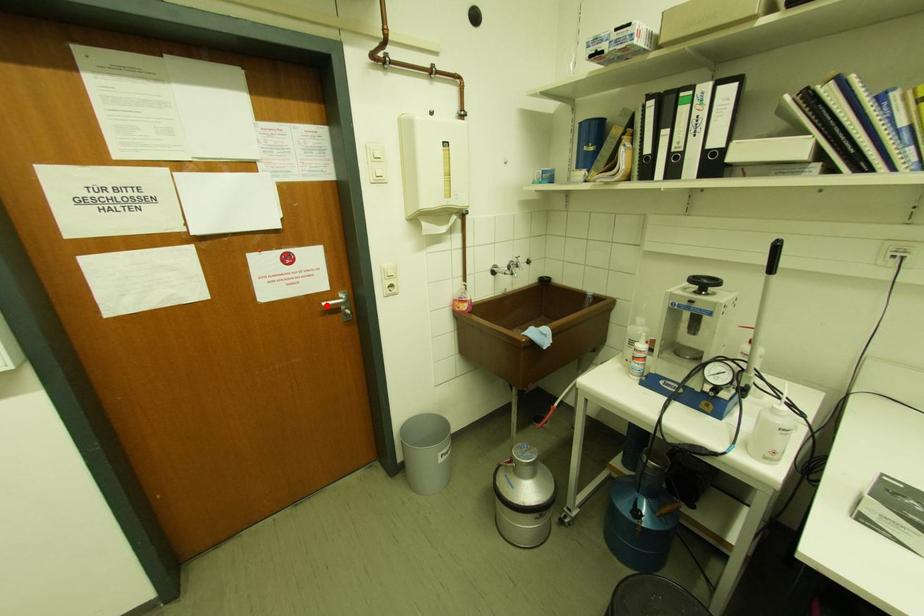
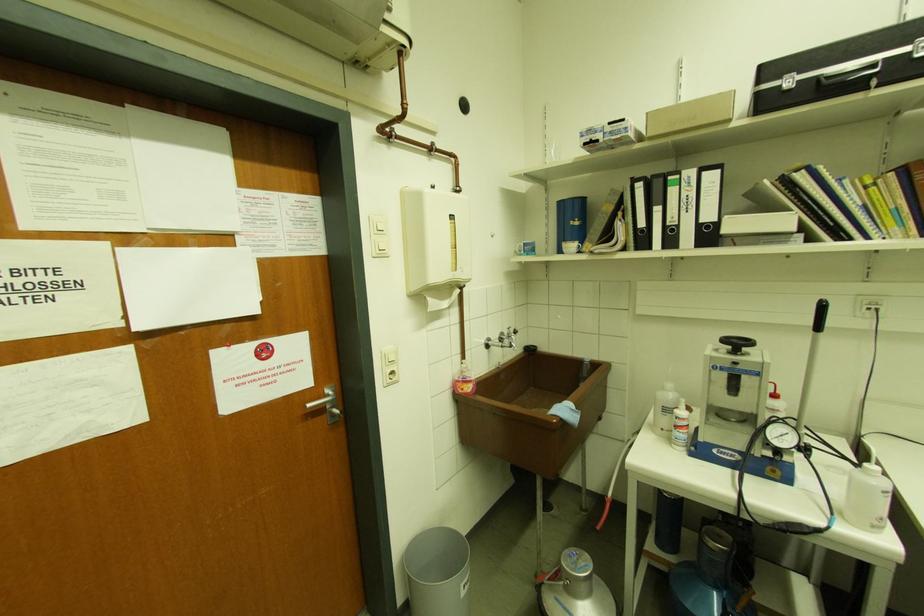
Locate, in the second image, the point that corresponds to the highlighted location in the first image.

(312, 407)